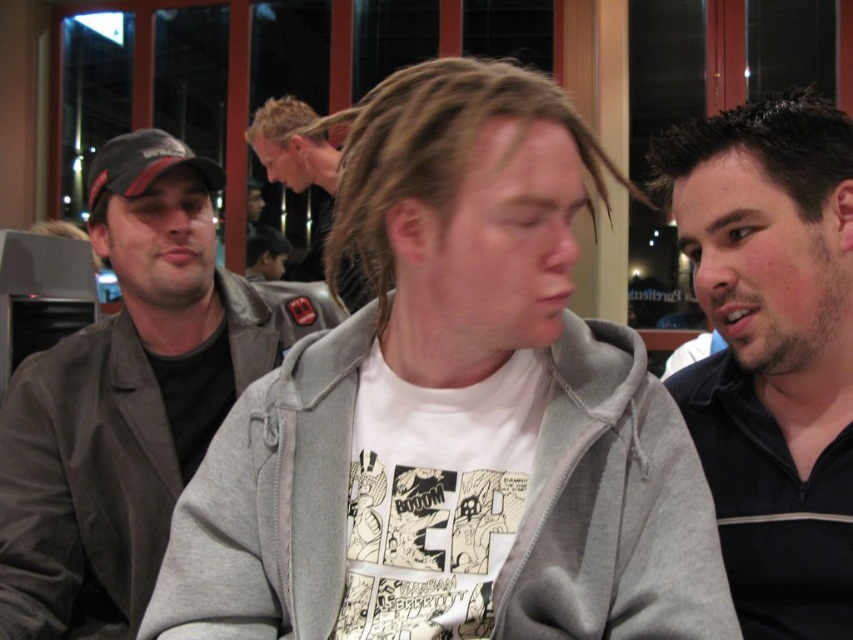
Question: Does dark brown hair at right have a smaller size compared to light brown hair at center?

Choices:
 (A) no
 (B) yes

Answer: (B)

Question: Can you confirm if dark gray jacket at left is thinner than light brown hair at center?

Choices:
 (A) yes
 (B) no

Answer: (B)

Question: Estimate the real-world distances between objects in this image. Which object is closer to the gray hoodie at center?

Choices:
 (A) dark brown hair at right
 (B) light brown hair at center
 (C) dark gray jacket at left

Answer: (A)

Question: Which of these objects is positioned farthest from the dark brown hair at right?

Choices:
 (A) dark gray jacket at left
 (B) light brown hair at center

Answer: (B)

Question: Can you confirm if gray hoodie at center is positioned above light brown hair at center?

Choices:
 (A) no
 (B) yes

Answer: (A)

Question: Which of the following is the closest to the observer?

Choices:
 (A) light brown hair at center
 (B) gray hoodie at center

Answer: (B)